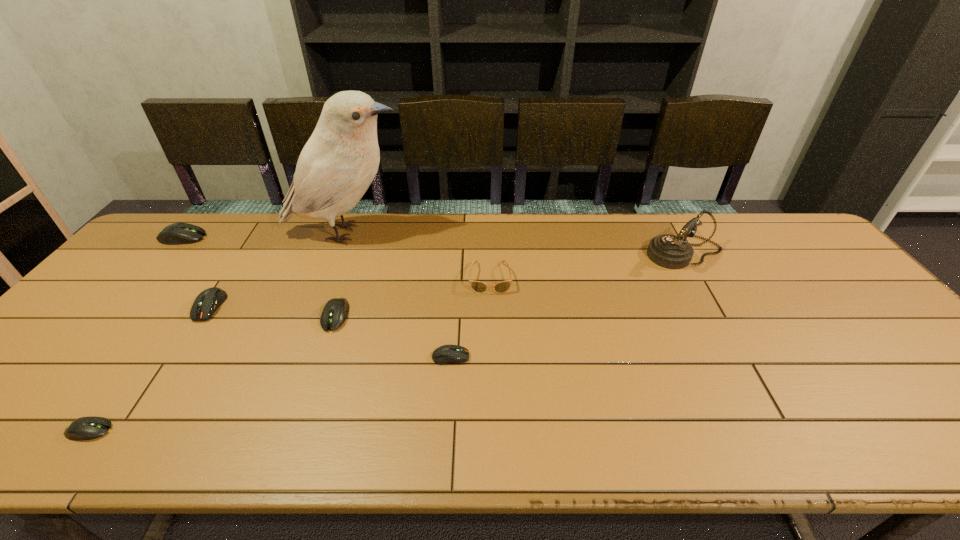
Find the location of a particular element. free spot that satisfies the following two spatial constraints: 1. on the wheel side of the fourth computer mouse from left to right; 2. on the wheel side of the second gray computer mouse from left to right is located at coordinates (297, 430).

Locate an element on the screen. The image size is (960, 540). free spot that satisfies the following two spatial constraints: 1. on the face of the parakeet; 2. on the button of the bigger dark computer equipment is located at coordinates (318, 306).